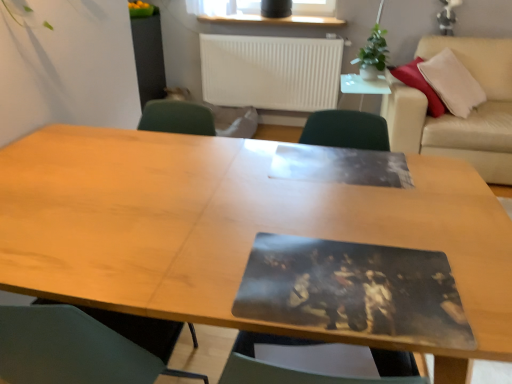
Question: Considering the relative positions of beige leather couch at upper right and white matte radiator at upper center in the image provided, is beige leather couch at upper right to the left or to the right of white matte radiator at upper center?

Choices:
 (A) left
 (B) right

Answer: (B)

Question: In the image, is beige leather couch at upper right positioned in front of or behind white matte radiator at upper center?

Choices:
 (A) front
 (B) behind

Answer: (A)

Question: Which of these objects is positioned closest to the wooden table at center?

Choices:
 (A) white matte radiator at upper center
 (B) green leafy plant at upper right
 (C) white glossy side table at upper center
 (D) beige leather couch at upper right

Answer: (D)

Question: Which object is the farthest from the beige leather couch at upper right?

Choices:
 (A) white matte radiator at upper center
 (B) green leafy plant at upper right
 (C) wooden table at center
 (D) white glossy side table at upper center

Answer: (C)